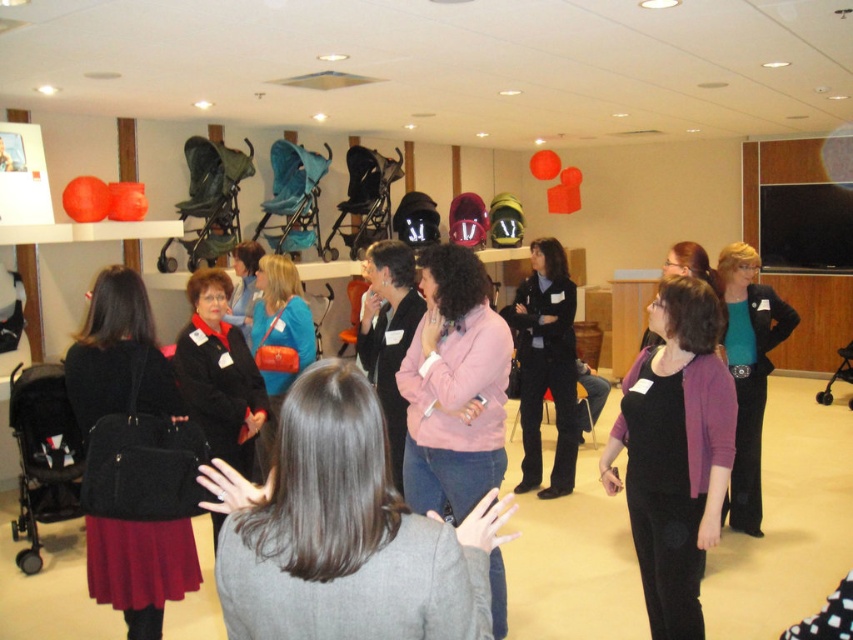
Question: Which point is closer to the camera?

Choices:
 (A) (271, 550)
 (B) (474, 292)

Answer: (A)

Question: Does pink matte sweater at center appear over velvet black purse at lower left?

Choices:
 (A) no
 (B) yes

Answer: (A)

Question: Which object appears closest to the camera in this image?

Choices:
 (A) matte black sweater at center
 (B) pink matte sweater at center

Answer: (B)

Question: Is velvet black purse at lower left to the left of teal jersey at center from the viewer's perspective?

Choices:
 (A) yes
 (B) no

Answer: (A)

Question: Which of the following is the farthest from the observer?

Choices:
 (A) matte orange purse at center
 (B) purple matte cardigan at center
 (C) gray wool coat at center
 (D) pink matte sweater at center

Answer: (A)

Question: Is matte black jacket at center smaller than teal jersey at center?

Choices:
 (A) no
 (B) yes

Answer: (B)